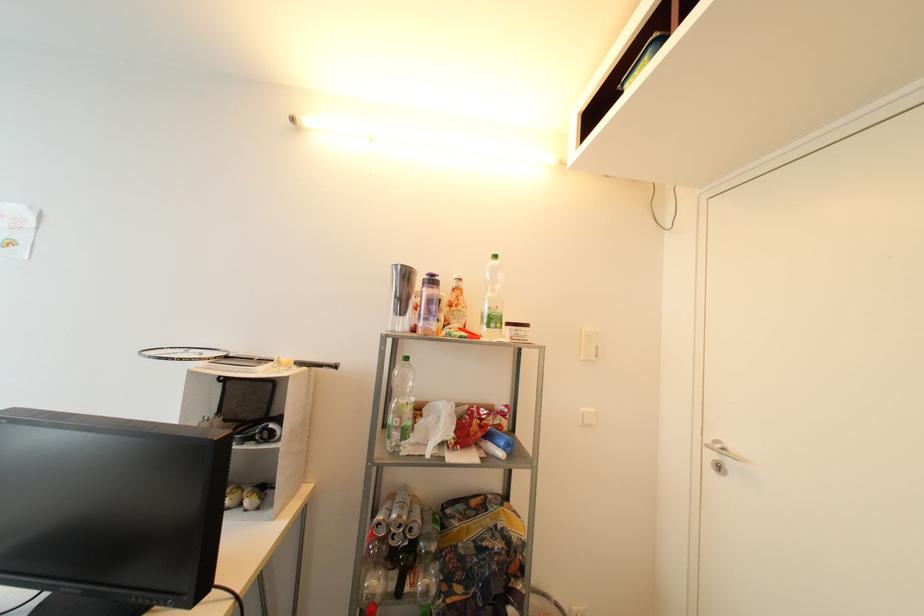
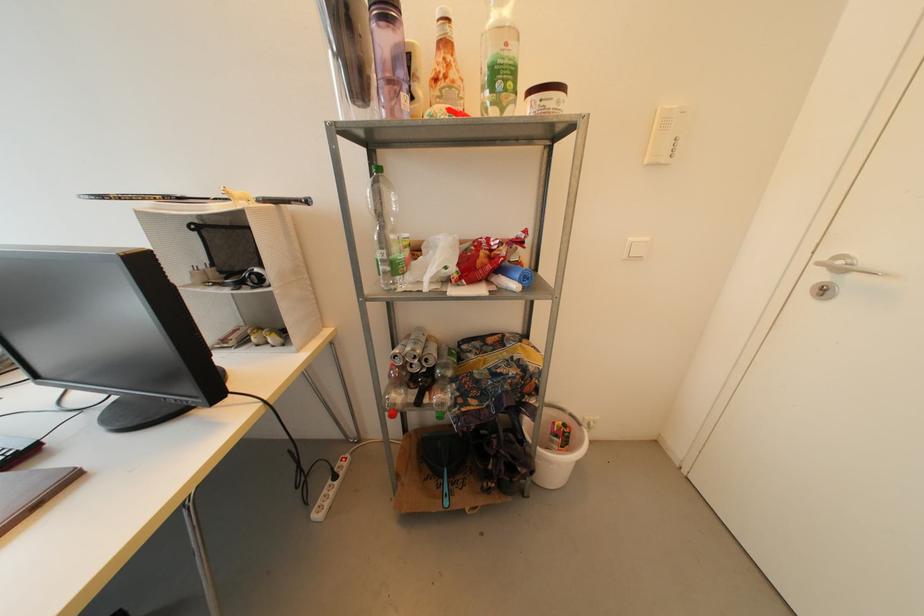
Question: Based on the continuous images, in which direction is the camera rotating? Reply with the corresponding letter.

Choices:
 (A) Left
 (B) Right
 (C) Up
 (D) Down

Answer: (D)